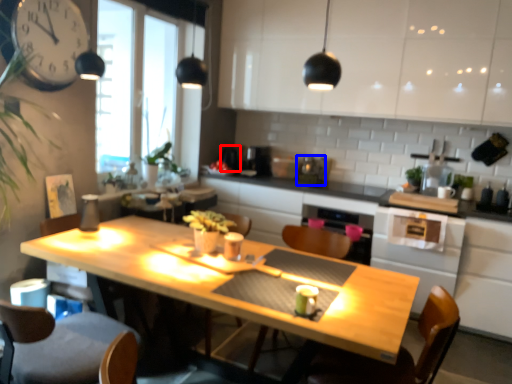
Question: Which point is further to the camera, appliance (highlighted by a red box) or appliance (highlighted by a blue box)?

Choices:
 (A) appliance
 (B) appliance

Answer: (A)